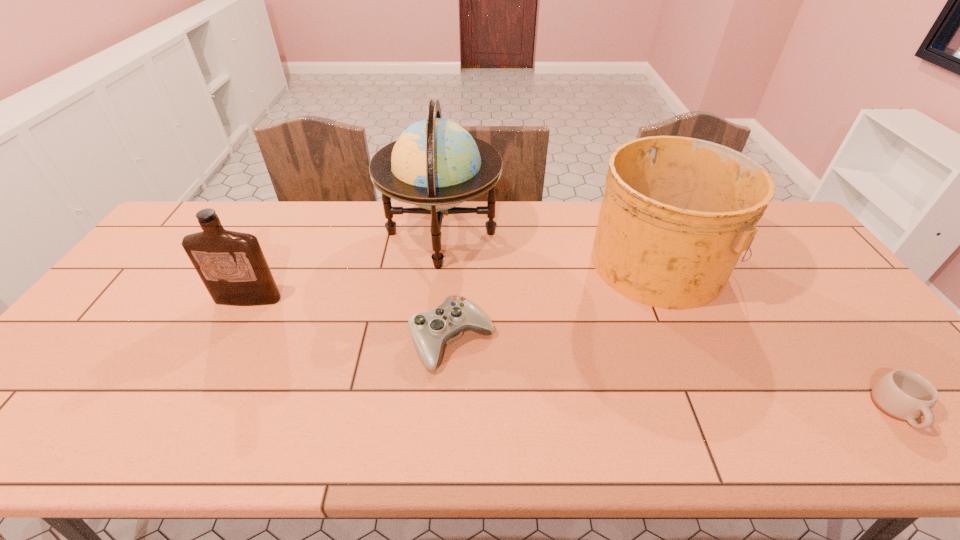
Image resolution: width=960 pixels, height=540 pixels. I want to click on object that is the closest one to the globe, so click(x=430, y=330).

The image size is (960, 540). What are the coordinates of `vacant point that satisfies the following two spatial constraints: 1. on the label side of the liquor; 2. on the left side of the control` in the screenshot? It's located at (227, 340).

Where is `vacant space that satisfies the following two spatial constraints: 1. on the surface of the globe; 2. on the right side of the bucket`? vacant space that satisfies the following two spatial constraints: 1. on the surface of the globe; 2. on the right side of the bucket is located at coordinates (439, 261).

This screenshot has width=960, height=540. I want to click on free space that satisfies the following two spatial constraints: 1. on the label side of the control; 2. on the left side of the leftmost object, so click(x=227, y=340).

Identify the location of free location that satisfies the following two spatial constraints: 1. on the surface of the fourth object from left to right; 2. on the left side of the globe. This screenshot has width=960, height=540. (439, 261).

Locate an element on the screen. This screenshot has height=540, width=960. free region that satisfies the following two spatial constraints: 1. on the surface of the globe; 2. on the label side of the liquor is located at coordinates (435, 299).

This screenshot has height=540, width=960. Find the location of `free spot that satisfies the following two spatial constraints: 1. on the back side of the bucket; 2. on the surface of the tallest object`. free spot that satisfies the following two spatial constraints: 1. on the back side of the bucket; 2. on the surface of the tallest object is located at coordinates (646, 233).

Image resolution: width=960 pixels, height=540 pixels. I want to click on free point that satisfies the following two spatial constraints: 1. on the surface of the control; 2. on the left side of the tallest object, so click(x=430, y=340).

Identify the location of free space that satisfies the following two spatial constraints: 1. on the surface of the tallest object; 2. on the right side of the control. The image size is (960, 540). (430, 340).

This screenshot has width=960, height=540. I want to click on vacant region that satisfies the following two spatial constraints: 1. on the label side of the leftmost object; 2. on the right side of the control, so click(x=227, y=340).